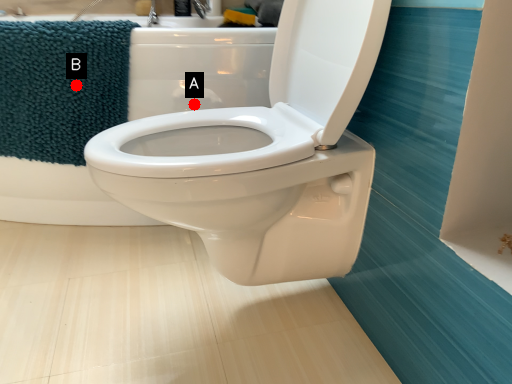
Question: Two points are circled on the image, labeled by A and B beside each circle. Which of the following is the farthest from the observer?

Choices:
 (A) A is further
 (B) B is further

Answer: (A)